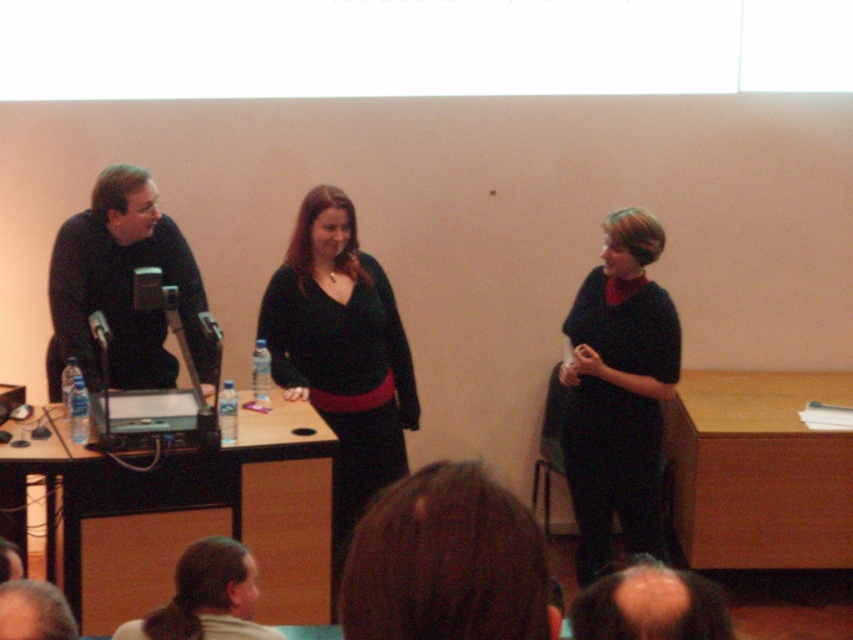
You are an attendee at the event and want to take a photo of the speaker wearing the matte black sweater at center and the light brown hair at lower center. Which one should you focus on first if you want to capture both in the same frame?

You should focus on the matte black sweater at center first because it is to the right of light brown hair at lower center, so adjusting focus from right to left would help capture both in the same frame.

You are standing at the front of the lecture hall and notice two points marked on the podium. The first point is at coordinates point [635,224] and the second is at point [132,218]. Which point is closer to your current position?

The point at coordinates point [635,224] is closer to the camera, so it is closer to your current position at the front of the lecture hall.

You are attending a lecture and notice the matte black sweater at center and the matte black microphone at left. Which object is taller?

The matte black sweater at center is taller than the matte black microphone at left.